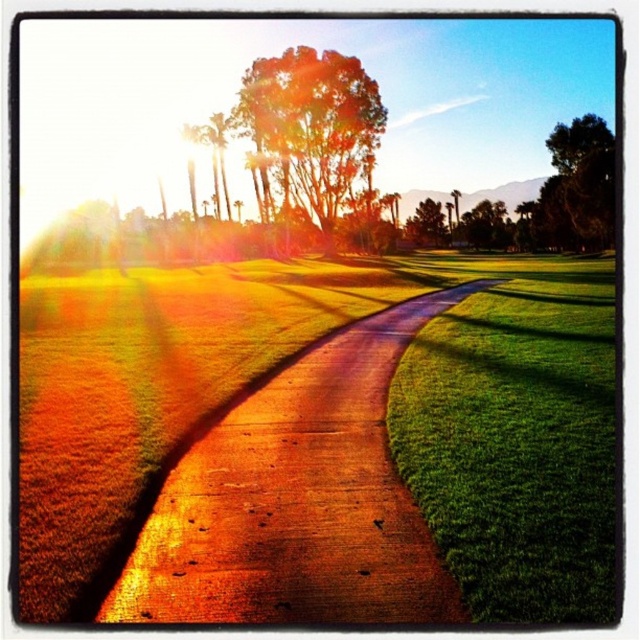
You are standing at the starting point of the dirt track at center. Which direction should you walk to reach the palm trees in the background?

You should walk forward along the dirt track at center since it curves gently towards the cluster of tall palm trees in the background.

You are standing at the starting point of the pathway on the golf course. You want to walk towards the green soft grass at center. Which direction should you move relative to the pathway?

The green soft grass at center is located at point (516, 436) in 2D coordinates. Since the pathway curves gently towards the palm trees in the background, you should follow the curve of the pathway to reach the green soft grass at center.

You are standing at the edge of the dirt track at center and want to walk towards the green leafy tree at center. Which direction should you move to reach the tree?

You should move to the right because the dirt track at center is to the left of the green leafy tree at center, so moving right will lead you towards the tree.